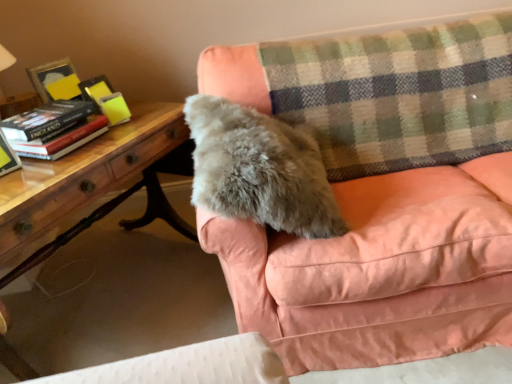
Locate an element on the screen. The image size is (512, 384). free space to the right of hardcover book at left is located at coordinates (117, 138).